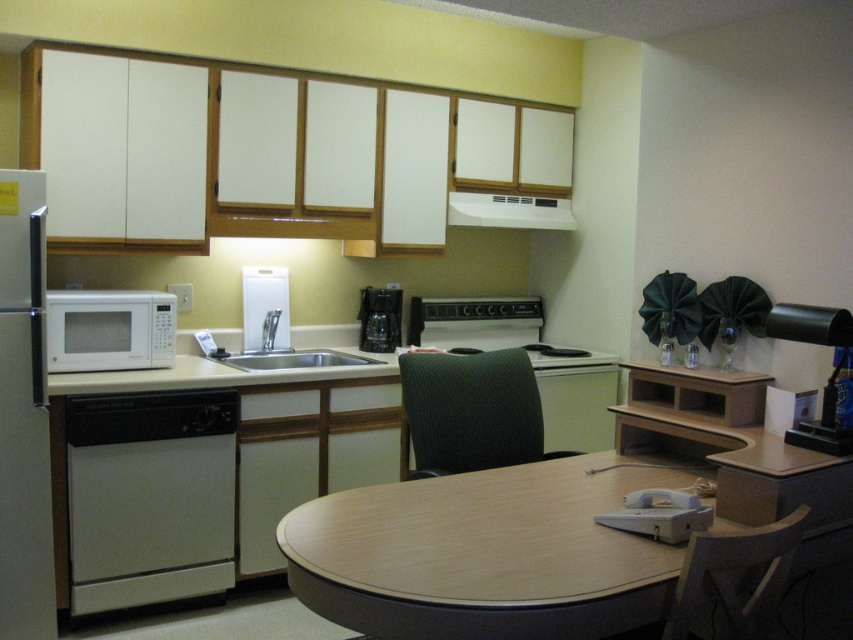
This screenshot has width=853, height=640. In order to click on white matte exhaust hood at upper center in this screenshot , I will do `click(509, 211)`.

Is white matte exhaust hood at upper center below white plastic faucet at center?

No.

The height and width of the screenshot is (640, 853). In order to click on white matte exhaust hood at upper center in this screenshot , I will do `click(509, 211)`.

Does point (33, 570) come closer to viewer compared to point (253, 340)?

Yes, point (33, 570) is closer to viewer.

Consider the image. Is white matte refrigerator at left closer to camera compared to silver metallic sink at center?

Yes, it is.

Which is in front, point (20, 440) or point (312, 360)?

Point (20, 440) is more forward.

This screenshot has width=853, height=640. Identify the location of white matte refrigerator at left. (22, 413).

Is white glossy dishwasher at lower left below white plastic faucet at center?

Indeed, white glossy dishwasher at lower left is positioned under white plastic faucet at center.

Is the position of white glossy dishwasher at lower left less distant than that of white plastic faucet at center?

That is True.

Is point (137, 422) farther from camera compared to point (276, 339)?

No, (137, 422) is in front of (276, 339).

The width and height of the screenshot is (853, 640). Find the location of `white glossy dishwasher at lower left`. white glossy dishwasher at lower left is located at coordinates (149, 497).